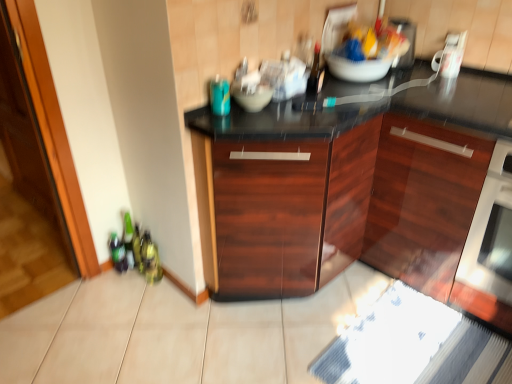
Locate an element on the screen. Image resolution: width=512 pixels, height=384 pixels. vacant area to the right of teal glass bottle at upper center is located at coordinates (273, 111).